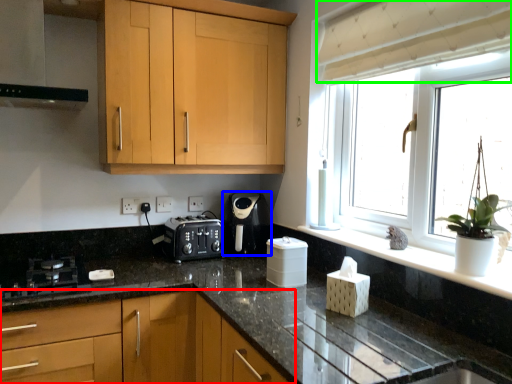
Question: Based on their relative distances, which object is nearer to cabinetry (highlighted by a red box)? Choose from kitchen appliance (highlighted by a blue box) and curtain (highlighted by a green box).

Choices:
 (A) kitchen appliance
 (B) curtain

Answer: (A)